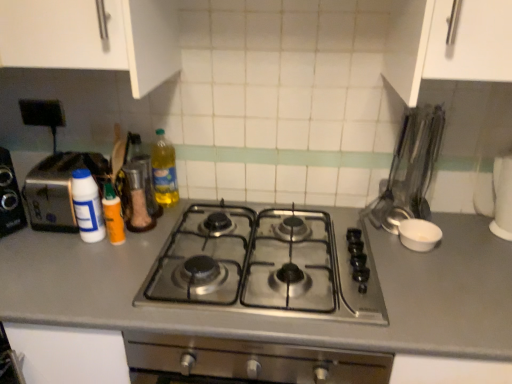
The height and width of the screenshot is (384, 512). I want to click on unoccupied area in front of silver metallic toaster at left, so click(52, 251).